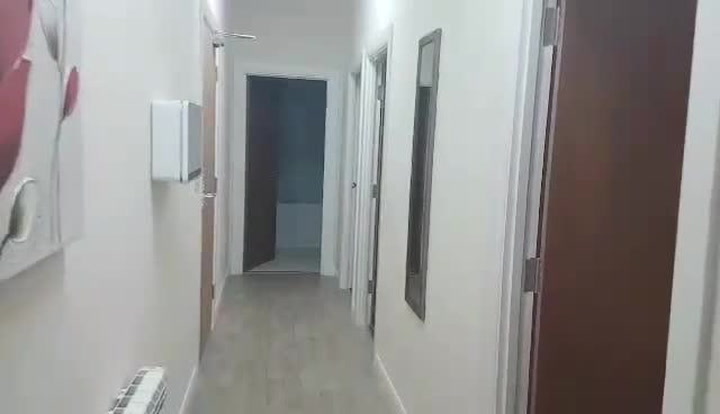
The width and height of the screenshot is (720, 414). I want to click on wood door, so click(x=624, y=354).